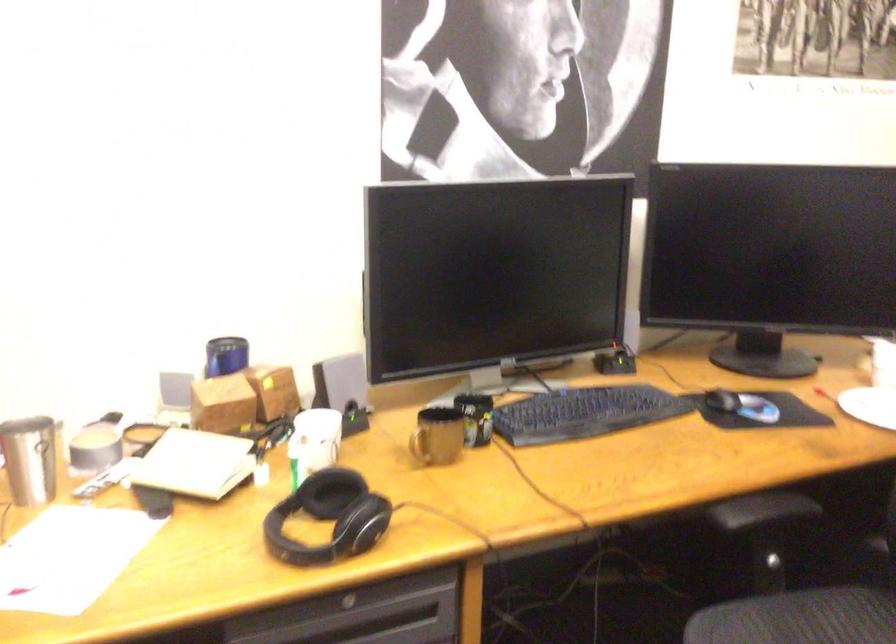
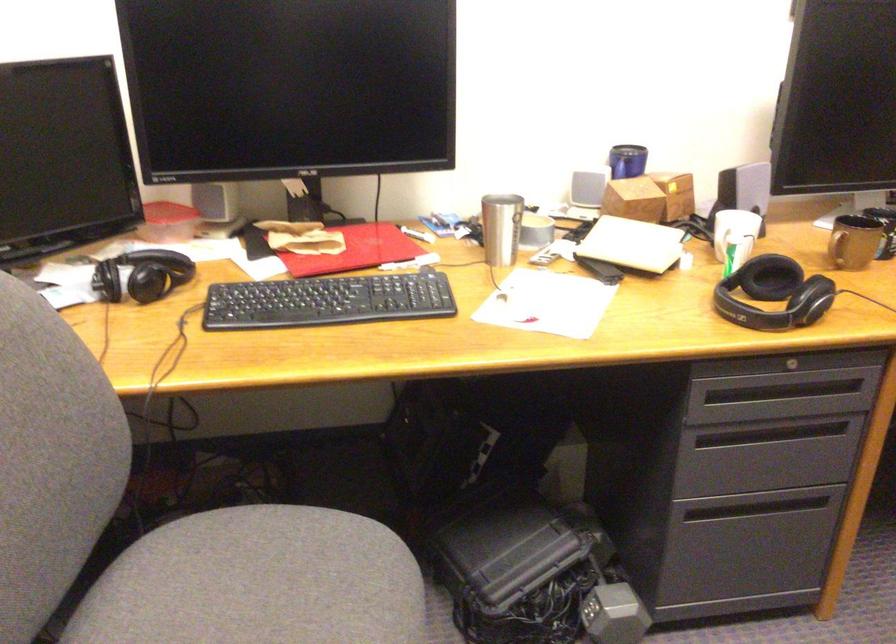
Find the pixel in the second image that matches (435,446) in the first image.

(854, 242)